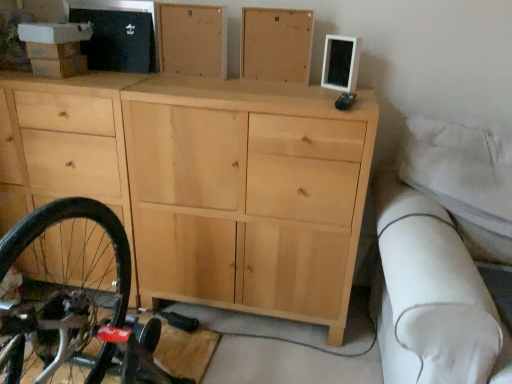
How much space does natural wood cabinet at upper center, which ranks as the first chest of drawer in left-to-right order, occupy vertically?

natural wood cabinet at upper center, which ranks as the first chest of drawer in left-to-right order, is 25.46 centimeters in height.

At what (x,y) coordinates should I click in order to perform the action: click on natural wood cabinet at upper center, which is the second chest of drawer in left-to-right order. Please return your answer as a coordinate pair (x, y). Looking at the image, I should click on (276, 44).

This screenshot has width=512, height=384. In order to click on natural wood cabinet at upper center, which is the second chest of drawer from right to left in this screenshot , I will do `click(192, 40)`.

Does natural wood cabinet at upper center, which is the second chest of drawer in left-to-right order, turn towards natural wood cabinet at upper center, which ranks as the first chest of drawer in left-to-right order?

No, natural wood cabinet at upper center, which is the second chest of drawer in left-to-right order, does not turn towards natural wood cabinet at upper center, which ranks as the first chest of drawer in left-to-right order.

Looking at the image, does natural wood cabinet at upper center, which is counted as the 1th chest of drawer, starting from the right, seem bigger or smaller compared to natural wood cabinet at upper center, which is the second chest of drawer from right to left?

Considering their sizes, natural wood cabinet at upper center, which is counted as the 1th chest of drawer, starting from the right, takes up less space than natural wood cabinet at upper center, which is the second chest of drawer from right to left.

Considering their positions, is natural wood cabinet at upper center, which is counted as the 1th chest of drawer, starting from the right, located in front of or behind natural wood cabinet at upper center, which is the second chest of drawer from right to left?

Clearly, natural wood cabinet at upper center, which is counted as the 1th chest of drawer, starting from the right, is in front of natural wood cabinet at upper center, which is the second chest of drawer from right to left.

From a real-world perspective, is natural wood cabinet at upper center, which is the second chest of drawer in left-to-right order, above or below natural wood cabinet at upper center, which ranks as the first chest of drawer in left-to-right order?

In terms of real-world spatial position, natural wood cabinet at upper center, which is the second chest of drawer in left-to-right order, is below natural wood cabinet at upper center, which ranks as the first chest of drawer in left-to-right order.

Considering the sizes of objects natural wood cabinet at upper center, which is the second chest of drawer in left-to-right order, and natural wood cabinet at center in the image provided, who is smaller, natural wood cabinet at upper center, which is the second chest of drawer in left-to-right order, or natural wood cabinet at center?

Smaller between the two is natural wood cabinet at upper center, which is the second chest of drawer in left-to-right order.

Between natural wood cabinet at upper center, which is counted as the 1th chest of drawer, starting from the right, and natural wood cabinet at center, which one is positioned in front?

Positioned in front is natural wood cabinet at center.

Is natural wood cabinet at upper center, which is counted as the 1th chest of drawer, starting from the right, inside or outside of natural wood cabinet at center?

natural wood cabinet at upper center, which is counted as the 1th chest of drawer, starting from the right, is located beyond the bounds of natural wood cabinet at center.

From a real-world perspective, relative to natural wood cabinet at center, is natural wood cabinet at upper center, which is the second chest of drawer in left-to-right order, vertically above or below?

natural wood cabinet at upper center, which is the second chest of drawer in left-to-right order, is situated higher than natural wood cabinet at center in the real world.

Would you say natural wood cabinet at center is outside natural wood cabinet at upper center, which is counted as the 1th chest of drawer, starting from the right?

natural wood cabinet at center lies outside natural wood cabinet at upper center, which is counted as the 1th chest of drawer, starting from the right,'s area.

Based on the photo, from the image's perspective, relative to natural wood cabinet at upper center, which is counted as the 1th chest of drawer, starting from the right, is natural wood cabinet at center above or below?

natural wood cabinet at center is below natural wood cabinet at upper center, which is counted as the 1th chest of drawer, starting from the right.

Are natural wood cabinet at center and natural wood cabinet at upper center, which is counted as the 1th chest of drawer, starting from the right, far apart?

They are positioned close to each other.

From a real-world perspective, which chest of drawer is the 1st one above the natural wood cabinet at center? Please provide its 2D coordinates.

[(276, 44)]

Can you tell me how much natural wood cabinet at center and natural wood cabinet at upper center, which ranks as the first chest of drawer in left-to-right order, differ in facing direction?

5.73 degrees separate the facing orientations of natural wood cabinet at center and natural wood cabinet at upper center, which ranks as the first chest of drawer in left-to-right order.

Consider the image. Who is taller, natural wood cabinet at center or natural wood cabinet at upper center, which is the second chest of drawer from right to left?

natural wood cabinet at center is taller.

Is natural wood cabinet at center not near natural wood cabinet at upper center, which is the second chest of drawer from right to left?

natural wood cabinet at center is near natural wood cabinet at upper center, which is the second chest of drawer from right to left, not far away.

Is point (220, 61) positioned before point (322, 183)?

No, (220, 61) is behind (322, 183).

Looking at this image, is natural wood cabinet at upper center, which is the second chest of drawer from right to left, smaller than natural wood cabinet at center?

Indeed, natural wood cabinet at upper center, which is the second chest of drawer from right to left, has a smaller size compared to natural wood cabinet at center.

Is natural wood cabinet at upper center, which ranks as the first chest of drawer in left-to-right order, at the right side of natural wood cabinet at upper center, which is counted as the 1th chest of drawer, starting from the right?

No, natural wood cabinet at upper center, which ranks as the first chest of drawer in left-to-right order, is not to the right of natural wood cabinet at upper center, which is counted as the 1th chest of drawer, starting from the right.

Is natural wood cabinet at upper center, which ranks as the first chest of drawer in left-to-right order, in front of or behind natural wood cabinet at upper center, which is the second chest of drawer in left-to-right order, in the image?

In the image, natural wood cabinet at upper center, which ranks as the first chest of drawer in left-to-right order, appears behind natural wood cabinet at upper center, which is the second chest of drawer in left-to-right order.

Would you say natural wood cabinet at upper center, which ranks as the first chest of drawer in left-to-right order, is inside or outside natural wood cabinet at upper center, which is the second chest of drawer in left-to-right order?

natural wood cabinet at upper center, which ranks as the first chest of drawer in left-to-right order, is located beyond the bounds of natural wood cabinet at upper center, which is the second chest of drawer in left-to-right order.

Measure the distance between natural wood cabinet at upper center, which ranks as the first chest of drawer in left-to-right order, and natural wood cabinet at upper center, which is counted as the 1th chest of drawer, starting from the right.

They are 19.32 centimeters apart.

In the image, there is a natural wood cabinet at upper center, which ranks as the first chest of drawer in left-to-right order. Identify the location of the chest of drawer below it (from a real-world perspective). (276, 44).

The width and height of the screenshot is (512, 384). I want to click on the 1st chest of drawer above when counting from the natural wood cabinet at center (from the image's perspective), so click(276, 44).

From the image, which object appears to be farther from natural wood cabinet at upper center, which is counted as the 1th chest of drawer, starting from the right, natural wood cabinet at upper center, which ranks as the first chest of drawer in left-to-right order, or natural wood cabinet at center?

natural wood cabinet at center lies further to natural wood cabinet at upper center, which is counted as the 1th chest of drawer, starting from the right, than the other object.

Considering their positions, is natural wood cabinet at center positioned closer to natural wood cabinet at upper center, which is the second chest of drawer from right to left, than natural wood cabinet at upper center, which is the second chest of drawer in left-to-right order?

Among the two, natural wood cabinet at upper center, which is the second chest of drawer in left-to-right order, is located nearer to natural wood cabinet at upper center, which is the second chest of drawer from right to left.

When comparing their distances from natural wood cabinet at upper center, which is counted as the 1th chest of drawer, starting from the right, does natural wood cabinet at center or natural wood cabinet at upper center, which ranks as the first chest of drawer in left-to-right order, seem closer?

natural wood cabinet at upper center, which ranks as the first chest of drawer in left-to-right order, is closer to natural wood cabinet at upper center, which is counted as the 1th chest of drawer, starting from the right.

Looking at the image, which one is located closer to natural wood cabinet at center, natural wood cabinet at upper center, which is the second chest of drawer from right to left, or natural wood cabinet at upper center, which is counted as the 1th chest of drawer, starting from the right?

natural wood cabinet at upper center, which is the second chest of drawer from right to left.

When comparing their distances from natural wood cabinet at center, does natural wood cabinet at upper center, which is the second chest of drawer in left-to-right order, or natural wood cabinet at upper center, which is the second chest of drawer from right to left, seem further?

Based on the image, natural wood cabinet at upper center, which is the second chest of drawer in left-to-right order, appears to be further to natural wood cabinet at center.

Considering their positions, is natural wood cabinet at upper center, which is counted as the 1th chest of drawer, starting from the right, positioned further to natural wood cabinet at upper center, which ranks as the first chest of drawer in left-to-right order, than natural wood cabinet at center?

The object further to natural wood cabinet at upper center, which ranks as the first chest of drawer in left-to-right order, is natural wood cabinet at center.

Locate an element on the screen. chest of drawer between natural wood cabinet at upper center, which ranks as the first chest of drawer in left-to-right order, and natural wood cabinet at center from top to bottom is located at coordinates (276, 44).